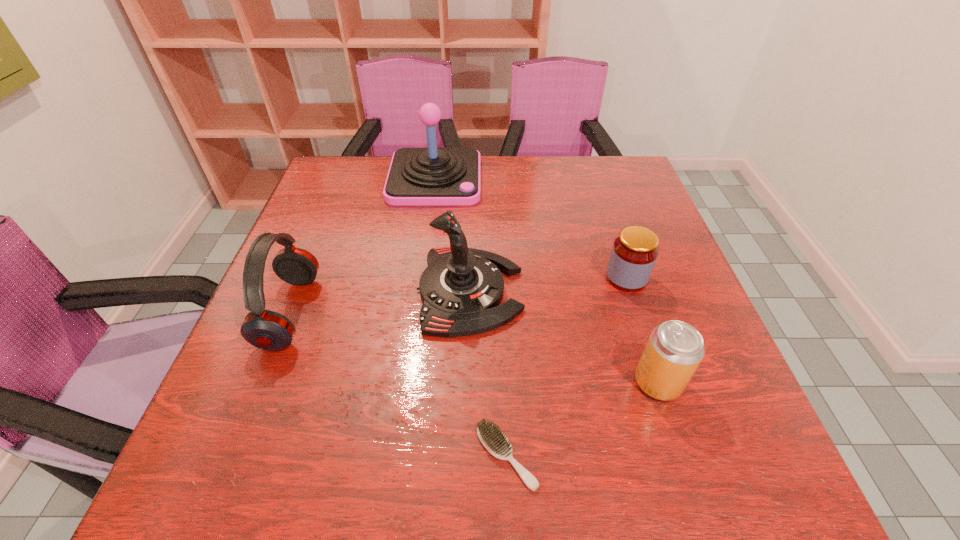
In the image, there is a desktop. Where is `vacant area at the left edge`? vacant area at the left edge is located at coordinates (333, 214).

In the image, there is a desktop. Identify the location of free space at the right edge. Image resolution: width=960 pixels, height=540 pixels. (710, 413).

Locate an element on the screen. The image size is (960, 540). vacant space at the far right corner of the desktop is located at coordinates (611, 198).

Find the location of a particular element. The image size is (960, 540). free region at the near right corner is located at coordinates (690, 484).

Locate an element on the screen. free point between the nearer joystick and the pop (soda) is located at coordinates (564, 336).

Identify the location of empty space between the leftmost object and the nearer joystick. The height and width of the screenshot is (540, 960). (380, 302).

Where is `vacant point located between the pop (soda) and the jar`? The width and height of the screenshot is (960, 540). vacant point located between the pop (soda) and the jar is located at coordinates (642, 330).

Where is `free spot between the jar and the nearer joystick`? Image resolution: width=960 pixels, height=540 pixels. free spot between the jar and the nearer joystick is located at coordinates (548, 284).

You are a GUI agent. You are given a task and a screenshot of the screen. Output one action in this format:
    pyautogui.click(x=<x>, y=<y>)
    Task: Click on the free area in between the nearer joystick and the scrubbing brush
    This screenshot has height=540, width=960.
    Given the screenshot: What is the action you would take?
    pyautogui.click(x=488, y=374)

Where is `vacant space that's between the nearer joystick and the second nearest object`? The height and width of the screenshot is (540, 960). vacant space that's between the nearer joystick and the second nearest object is located at coordinates (564, 336).